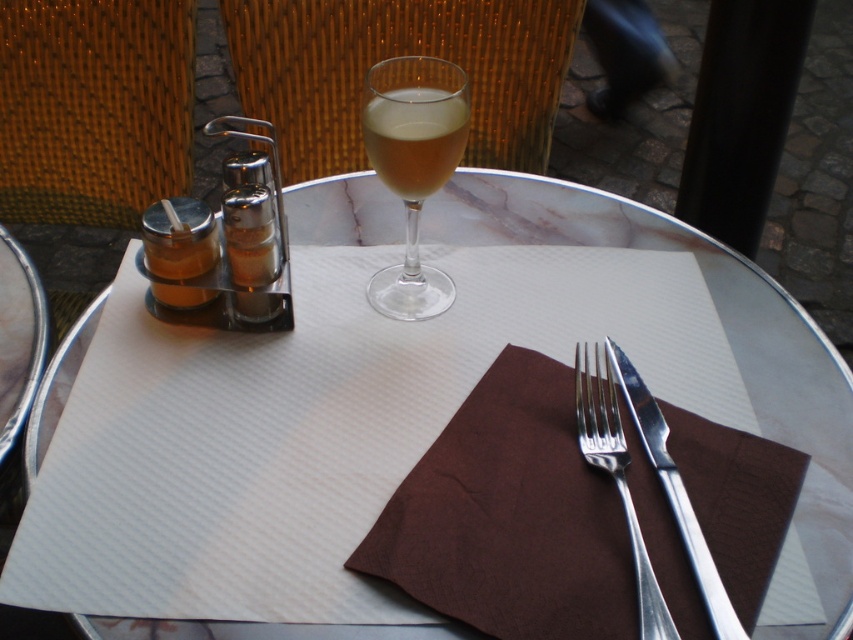
Does translucent glass at center have a greater width compared to silver metallic fork at center?

Indeed, translucent glass at center has a greater width compared to silver metallic fork at center.

Does translucent glass at center have a larger size compared to silver metallic fork at center?

No.

Where is `translucent glass at center`? translucent glass at center is located at coordinates click(415, 138).

From the picture: Is brown paper napkin at center above silver metallic fork at center?

No, brown paper napkin at center is not above silver metallic fork at center.

Is brown paper napkin at center to the right of silver metallic fork at center from the viewer's perspective?

Incorrect, brown paper napkin at center is not on the right side of silver metallic fork at center.

Find the location of a particular element. Image resolution: width=853 pixels, height=640 pixels. brown paper napkin at center is located at coordinates (509, 516).

Locate an element on the screen. The width and height of the screenshot is (853, 640). brown paper napkin at center is located at coordinates (509, 516).

Which is in front, point (422, 163) or point (412, 104)?

Positioned in front is point (412, 104).

Is clear glass wine glass at center taller than translucent glass at center?

Indeed, clear glass wine glass at center has a greater height compared to translucent glass at center.

I want to click on clear glass wine glass at center, so click(413, 166).

Find the location of `clear glass wine glass at center`. clear glass wine glass at center is located at coordinates (413, 166).